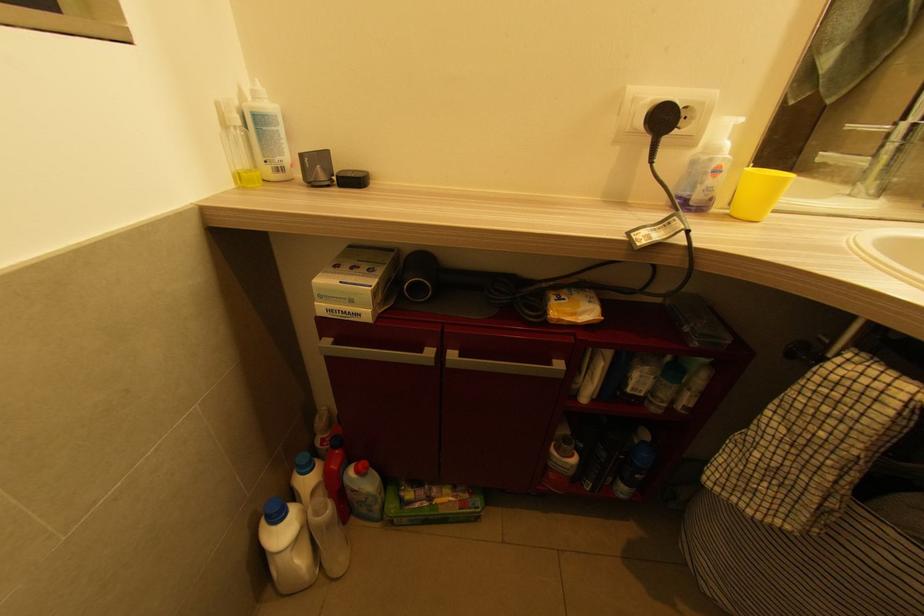
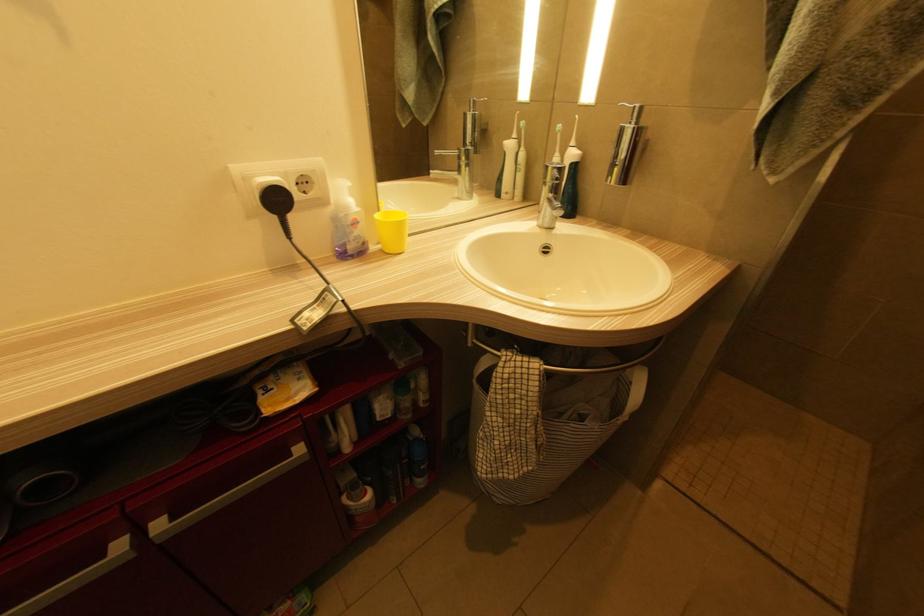
Question: The first image is from the beginning of the video and the second image is from the end. How did the camera likely rotate when shooting the video?

Choices:
 (A) Left
 (B) Right
 (C) Up
 (D) Down

Answer: (B)